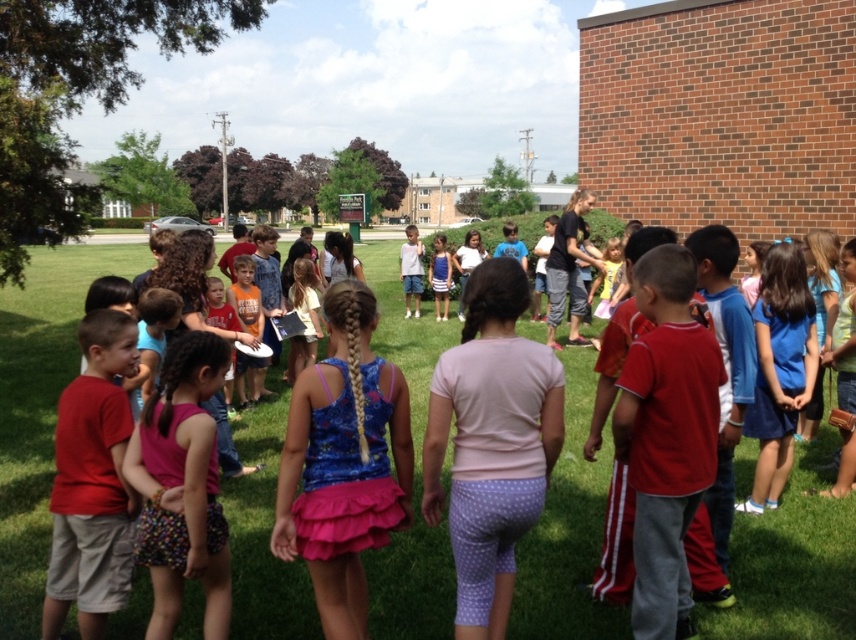
Question: Which of the following is the farthest from the observer?

Choices:
 (A) (113, 538)
 (B) (407, 392)

Answer: (A)

Question: Is blue printed tank top at center positioned before multicolored fabric shorts at center?

Choices:
 (A) yes
 (B) no

Answer: (A)

Question: Does pink fabric shirt at center appear under matte red shirt at left?

Choices:
 (A) no
 (B) yes

Answer: (A)

Question: Estimate the real-world distances between objects in this image. Which object is closer to the blue striped dress at center?

Choices:
 (A) multicolored fabric shorts at center
 (B) pink fabric shirt at center

Answer: (A)

Question: Does green grass at center appear on the right side of blue striped dress at center?

Choices:
 (A) no
 (B) yes

Answer: (A)

Question: Which of these objects is positioned farthest from the blue striped dress at center?

Choices:
 (A) green grass at center
 (B) pink fabric shirt at center
 (C) matte red shirt at left

Answer: (B)